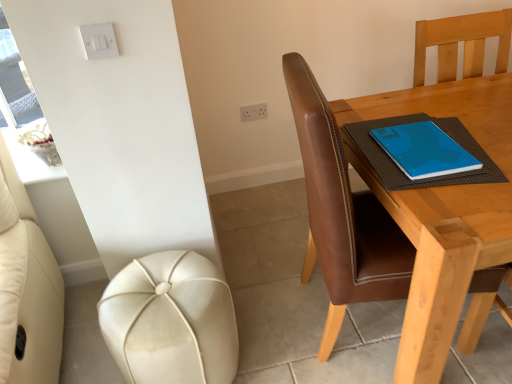
Locate an element on the screen. free space in front of blue matte notebook at upper right is located at coordinates (462, 210).